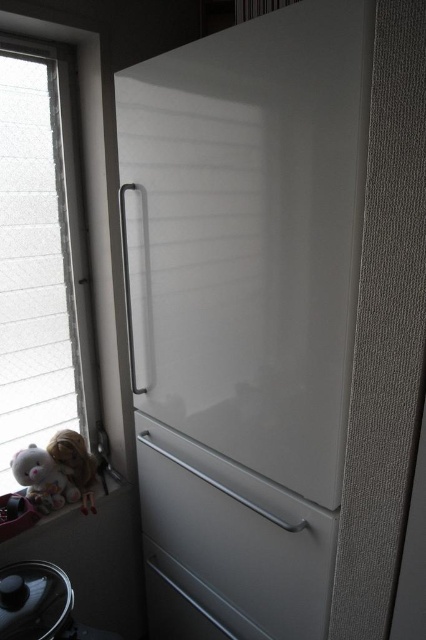
Looking at this image, you are organizing items on the kitchen counter and need to place the fluffy white teddy bear at lower left. Considering the clear glass window at left is already occupying space, can you fit the teddy bear without moving the window?

The clear glass window at left is larger in size than the fluffy white teddy bear at lower left, so there should be enough space to place the teddy bear without moving the window.

You are organizing items in the kitchen and want to place a large decorative plate. Which object, the clear glass window at left or the matte plastic window sill at lower left, can accommodate the plate based on their sizes?

The clear glass window at left is bigger than the matte plastic window sill at lower left, so the plate can be placed on the clear glass window at left.

You are trying to clean the clear glass window at left and the matte plastic window sill at lower left. Which one should you clean first if you want to avoid getting the other one wet?

You should clean the matte plastic window sill at lower left first because the clear glass window at left is in front of it. Cleaning the window sill afterward would cause water or cleaner to drip onto the already cleaned window below.